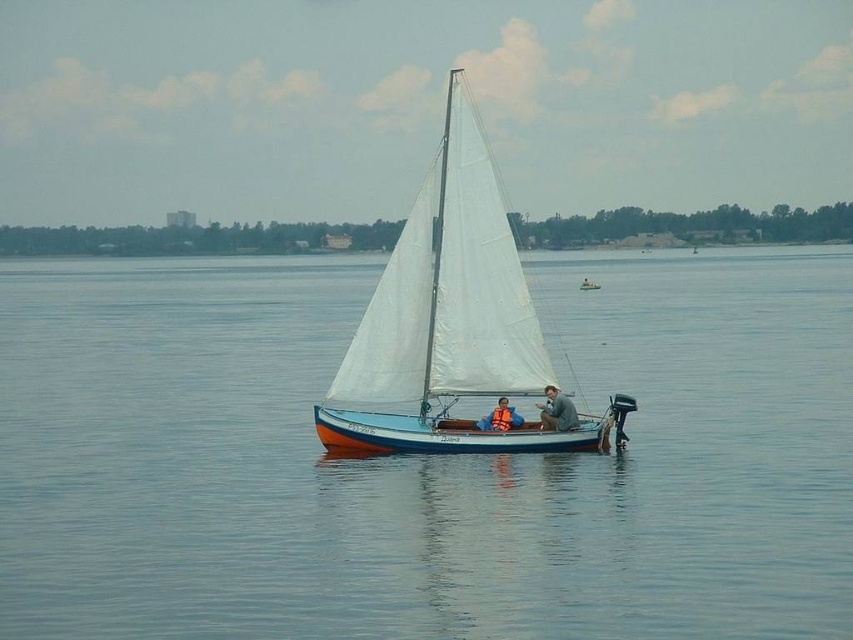
You are navigating a drone over a serene lake and need to drop a life preserver to the person on the sailboat. The coordinates for the blue smooth water at center are point (x=422, y=458). Where should you aim the drone to ensure the life preserver lands closest to the person on the sailboat?

The blue smooth water at center is located at point (x=422, y=458), so you should aim the drone at that coordinate to drop the life preserver closest to the person on the sailboat.

You are a safety inspector checking the distance between the blue smooth water at center and the orange life vest at center on the sailboat. According to safety regulations, the maximum allowed distance between a life vest and the water surface is 60 feet. Is the current placement compliant?

The distance between the blue smooth water at center and the orange life vest at center is 56.84 feet, which is under the 60 feet maximum allowed distance. Therefore, the current placement is compliant with safety regulations.